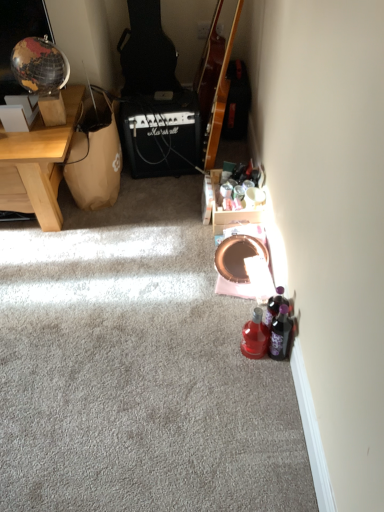
Where is `white cardboard box at upper left`? Image resolution: width=384 pixels, height=512 pixels. white cardboard box at upper left is located at coordinates (13, 118).

Describe the element at coordinates (214, 84) in the screenshot. I see `glossy wood guitar at upper center` at that location.

At what (x,y) coordinates should I click in order to perform the action: click on glossy wood guitar at upper center. Please return your answer as a coordinate pair (x, y). This screenshot has height=512, width=384. Looking at the image, I should click on (214, 84).

Describe the element at coordinates (162, 134) in the screenshot. The image size is (384, 512). I see `black matte marshall amplifier at center` at that location.

This screenshot has width=384, height=512. I want to click on translucent plastic bottle at lower right, arranged as the 1th bottle when viewed from the left, so click(x=255, y=336).

Find the location of `wooden desk at left`. wooden desk at left is located at coordinates (38, 164).

You are a GUI agent. You are given a task and a screenshot of the screen. Output one action in this format:
    pyautogui.click(x=<x>, y=<y>)
    Task: Click on the white cardboard box at upper left
    
    Given the screenshot: What is the action you would take?
    pyautogui.click(x=13, y=118)

What's the angular difference between wooden desk at left and glossy wood guitar at upper center's facing directions?

wooden desk at left and glossy wood guitar at upper center are facing 95.1 degrees away from each other.

Between wooden desk at left and glossy wood guitar at upper center, which one has less height?

wooden desk at left.

Is wooden desk at left inside the boundaries of glossy wood guitar at upper center, or outside?

wooden desk at left cannot be found inside glossy wood guitar at upper center.

Does wooden desk at left turn towards glossy wood guitar at upper center?

No, wooden desk at left is not facing towards glossy wood guitar at upper center.

Which is more to the left, translucent purple bottle at lower right, marked as the 2th bottle in a left-to-right arrangement, or translucent plastic bottle at lower right, acting as the third bottle starting from the right?

From the viewer's perspective, translucent plastic bottle at lower right, acting as the third bottle starting from the right, appears more on the left side.

Which object is wider, translucent purple bottle at lower right, which is the 2th bottle in right-to-left order, or translucent plastic bottle at lower right, acting as the third bottle starting from the right?

translucent plastic bottle at lower right, acting as the third bottle starting from the right, is wider.

From the image's perspective, does translucent purple bottle at lower right, marked as the 2th bottle in a left-to-right arrangement, appear higher than translucent plastic bottle at lower right, acting as the third bottle starting from the right?

Yes, from the image's perspective, translucent purple bottle at lower right, marked as the 2th bottle in a left-to-right arrangement, is on top of translucent plastic bottle at lower right, acting as the third bottle starting from the right.

From the image's perspective, starting from the translucent plastic bottle at lower right, arranged as the 1th bottle when viewed from the left, which bottle is the 2nd one above? Please provide its 2D coordinates.

[(275, 305)]

Is translucent plastic bottle at lower right, arranged as the 1th bottle when viewed from the left, oriented away from glossy wood guitar at upper center?

That's not correct — translucent plastic bottle at lower right, arranged as the 1th bottle when viewed from the left, is not looking away from glossy wood guitar at upper center.

Which is nearer, (261, 353) or (220, 7)?

Point (261, 353)

There is a translucent plastic bottle at lower right, arranged as the 1th bottle when viewed from the left. Find the location of `guitar above it (from a real-world perspective)`. guitar above it (from a real-world perspective) is located at coordinates (214, 84).

Consider the image. Does translucent plastic bottle at lower right, arranged as the 1th bottle when viewed from the left, contain glossy wood guitar at upper center?

No.

Which is closer to the camera, [105,155] or [286,343]?

Point [105,155] appears to be farther away from the viewer than point [286,343].

Consider the image. From a real-world perspective, is brown paper bag at left positioned under purple matte bottle at lower right, marked as the third bottle in a left-to-right arrangement, based on gravity?

Actually, brown paper bag at left is physically above purple matte bottle at lower right, marked as the third bottle in a left-to-right arrangement, in the real world.

Considering the sizes of objects brown paper bag at left and purple matte bottle at lower right, marked as the third bottle in a left-to-right arrangement, in the image provided, who is shorter, brown paper bag at left or purple matte bottle at lower right, marked as the third bottle in a left-to-right arrangement,?

With less height is purple matte bottle at lower right, marked as the third bottle in a left-to-right arrangement.

From the image's perspective, is brown paper bag at left under purple matte bottle at lower right, marked as the third bottle in a left-to-right arrangement?

No, from the image's perspective, brown paper bag at left is not below purple matte bottle at lower right, marked as the third bottle in a left-to-right arrangement.

Does brown paper bag at left have a smaller size compared to translucent purple bottle at lower right, which is the 2th bottle in right-to-left order?

No, brown paper bag at left is not smaller than translucent purple bottle at lower right, which is the 2th bottle in right-to-left order.

From a real-world perspective, which is physically above, brown paper bag at left or translucent purple bottle at lower right, which is the 2th bottle in right-to-left order?

In real-world perspective, brown paper bag at left is above.

Is brown paper bag at left beside translucent purple bottle at lower right, which is the 2th bottle in right-to-left order?

No, brown paper bag at left is not in contact with translucent purple bottle at lower right, which is the 2th bottle in right-to-left order.

Locate an element on the screen. The height and width of the screenshot is (512, 384). the 2nd bottle directly beneath the brown paper bag at left (from a real-world perspective) is located at coordinates (275, 305).

Considering the points (21, 130) and (282, 358), which point is behind, point (21, 130) or point (282, 358)?

The point (21, 130) is behind.

Is white cardboard box at upper left facing towards purple matte bottle at lower right, marked as the 1th bottle in a right-to-left arrangement?

No, white cardboard box at upper left is not aimed at purple matte bottle at lower right, marked as the 1th bottle in a right-to-left arrangement.

Based on the photo, is white cardboard box at upper left located outside purple matte bottle at lower right, marked as the third bottle in a left-to-right arrangement?

Yes, white cardboard box at upper left is located beyond the bounds of purple matte bottle at lower right, marked as the third bottle in a left-to-right arrangement.

From a real-world perspective, who is located higher, white cardboard box at upper left or purple matte bottle at lower right, marked as the 1th bottle in a right-to-left arrangement?

white cardboard box at upper left is physically above.

How different are the orientations of wooden desk at left and black matte marshall amplifier at center in degrees?

1.43 degrees separate the facing orientations of wooden desk at left and black matte marshall amplifier at center.

Is wooden desk at left positioned with its back to black matte marshall amplifier at center?

No, wooden desk at left's orientation is not away from black matte marshall amplifier at center.

Where is `loudspeaker that is on the right side of wooden desk at left`? The width and height of the screenshot is (384, 512). loudspeaker that is on the right side of wooden desk at left is located at coordinates (162, 134).

Consider the image. Are wooden desk at left and black matte marshall amplifier at center located far from each other?

wooden desk at left is near black matte marshall amplifier at center, not far away.

What are the coordinates of `guitar that is on the right side of wooden desk at left` in the screenshot? It's located at (214, 84).

Identify the location of bottle behind the translucent plastic bottle at lower right, acting as the third bottle starting from the right. (275, 305).

Considering their positions, is translucent plastic bottle at lower right, acting as the third bottle starting from the right, positioned further to black matte marshall amplifier at center than wooden desk at left?

translucent plastic bottle at lower right, acting as the third bottle starting from the right.

Considering their positions, is brown paper bag at left positioned further to translucent purple bottle at lower right, marked as the 2th bottle in a left-to-right arrangement, than glossy wood guitar at upper center?

glossy wood guitar at upper center is positioned further to the anchor translucent purple bottle at lower right, marked as the 2th bottle in a left-to-right arrangement.

Which object lies further to the anchor point brown paper bag at left, white cardboard box at upper left or wooden desk at left?

white cardboard box at upper left lies further to brown paper bag at left than the other object.

When comparing their distances from translucent purple bottle at lower right, which is the 2th bottle in right-to-left order, does glossy wood guitar at upper center or translucent plastic bottle at lower right, acting as the third bottle starting from the right, seem further?

glossy wood guitar at upper center is further to translucent purple bottle at lower right, which is the 2th bottle in right-to-left order.

From the image, which object appears to be nearer to glossy wood guitar at upper center, wooden desk at left or white cardboard box at upper left?

Based on the image, wooden desk at left appears to be nearer to glossy wood guitar at upper center.

Based on their spatial positions, is black matte marshall amplifier at center or purple matte bottle at lower right, marked as the third bottle in a left-to-right arrangement, further from translucent plastic bottle at lower right, arranged as the 1th bottle when viewed from the left?

black matte marshall amplifier at center is further to translucent plastic bottle at lower right, arranged as the 1th bottle when viewed from the left.

Looking at the image, which one is located further to white cardboard box at upper left, black matte marshall amplifier at center or translucent plastic bottle at lower right, arranged as the 1th bottle when viewed from the left?

translucent plastic bottle at lower right, arranged as the 1th bottle when viewed from the left.

Based on their spatial positions, is translucent plastic bottle at lower right, acting as the third bottle starting from the right, or brown paper bag at left further from black matte marshall amplifier at center?

Based on the image, translucent plastic bottle at lower right, acting as the third bottle starting from the right, appears to be further to black matte marshall amplifier at center.

What are the coordinates of `box situated between wooden desk at left and translucent purple bottle at lower right, marked as the 2th bottle in a left-to-right arrangement, from left to right` in the screenshot? It's located at coord(13,118).

In order to click on loudspeaker situated between wooden desk at left and purple matte bottle at lower right, marked as the 1th bottle in a right-to-left arrangement, from left to right in this screenshot , I will do pyautogui.click(x=162, y=134).

Find the location of `handbag located between wooden desk at left and purple matte bottle at lower right, marked as the third bottle in a left-to-right arrangement, in the left-right direction`. handbag located between wooden desk at left and purple matte bottle at lower right, marked as the third bottle in a left-to-right arrangement, in the left-right direction is located at coordinates (95, 159).

Identify the location of bottle between white cardboard box at upper left and translucent purple bottle at lower right, which is the 2th bottle in right-to-left order, in the horizontal direction. (255, 336).